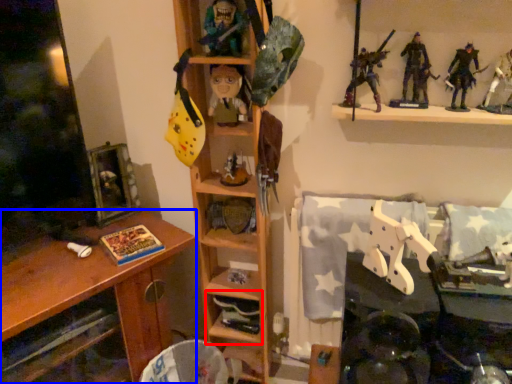
Question: Which of the following is the closest to the observer, shelf (highlighted by a red box) or desk (highlighted by a blue box)?

Choices:
 (A) shelf
 (B) desk

Answer: (B)